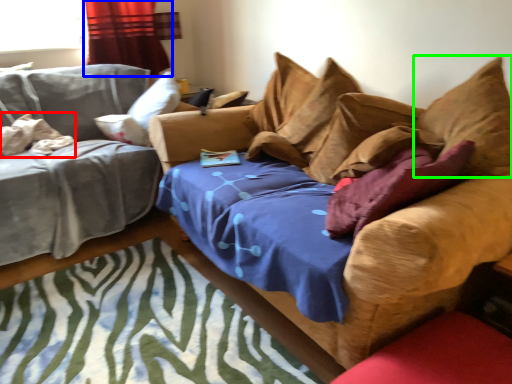
Question: Which object is the farthest from pillow (highlighted by a red box)? Choose among these: curtain (highlighted by a blue box) or pillow (highlighted by a green box).

Choices:
 (A) curtain
 (B) pillow

Answer: (B)